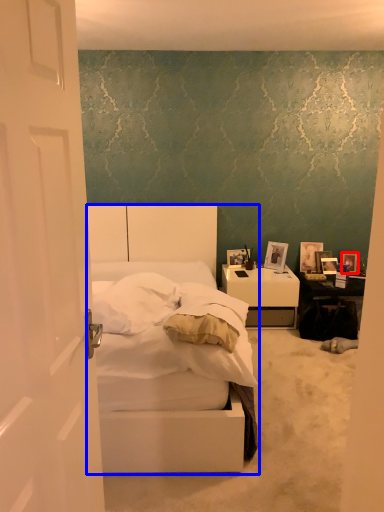
Question: Which object appears closest to the camera in this image, picture frame (highlighted by a red box) or bed (highlighted by a blue box)?

Choices:
 (A) picture frame
 (B) bed

Answer: (B)